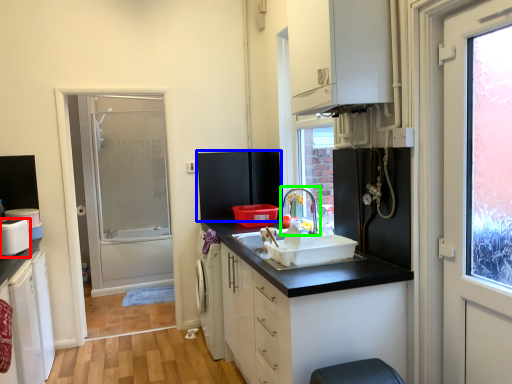
Question: Which object is the farthest from appliance (highlighted by a red box)? Choose among these: appliance (highlighted by a blue box) or tap (highlighted by a green box).

Choices:
 (A) appliance
 (B) tap

Answer: (B)